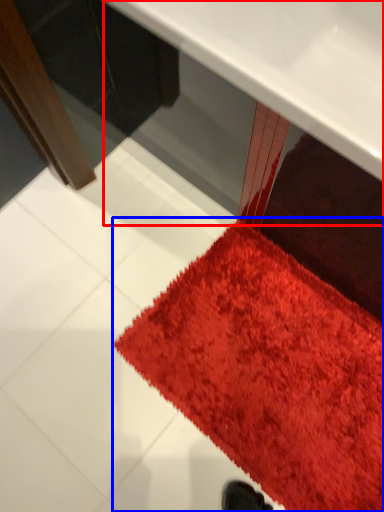
Question: Among these objects, which one is farthest to the camera, table (highlighted by a red box) or mat (highlighted by a blue box)?

Choices:
 (A) table
 (B) mat

Answer: (B)